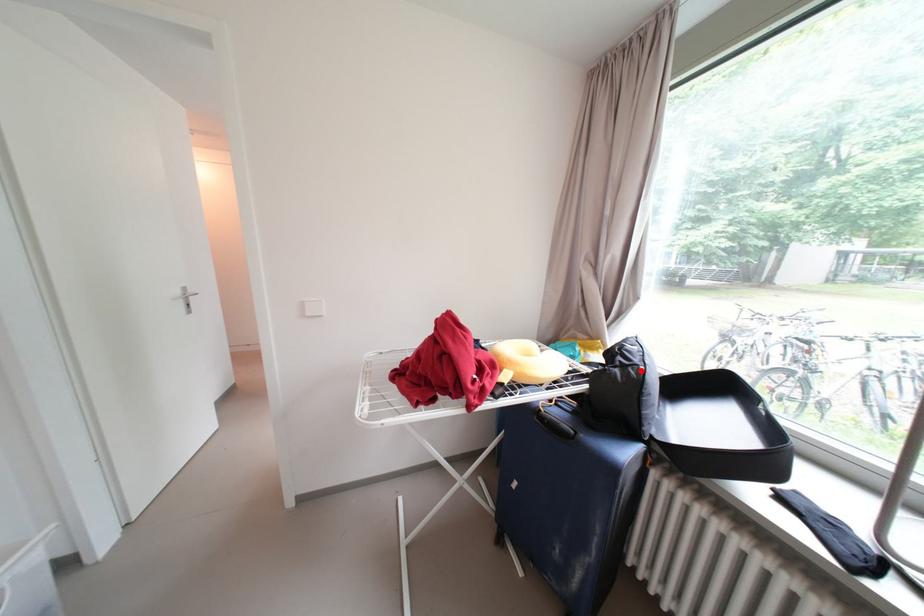
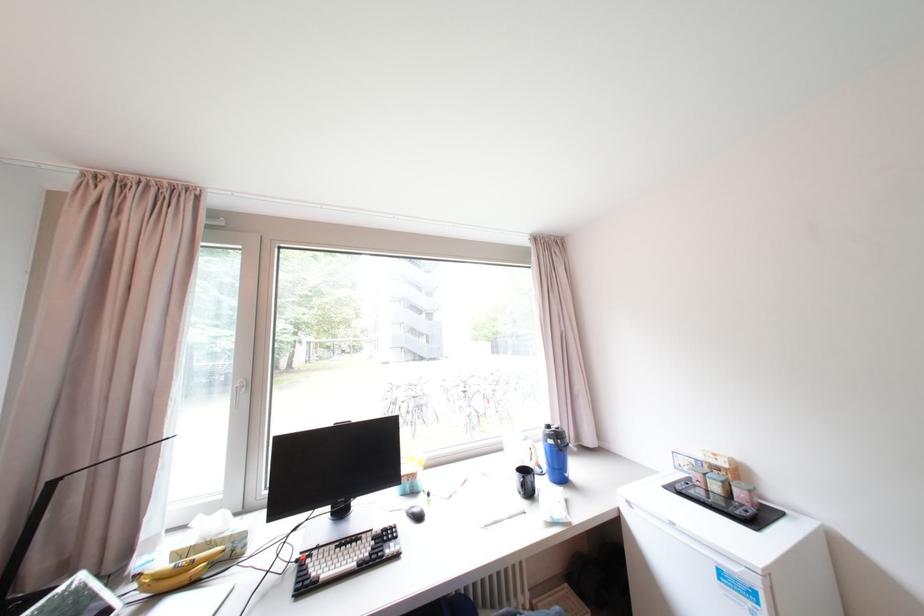
Question: I am providing you with two images of the same scene from different viewpoints. A red point is marked on the first image. Can you still see the location of the red point in image 2?

Choices:
 (A) Yes
 (B) No

Answer: (B)